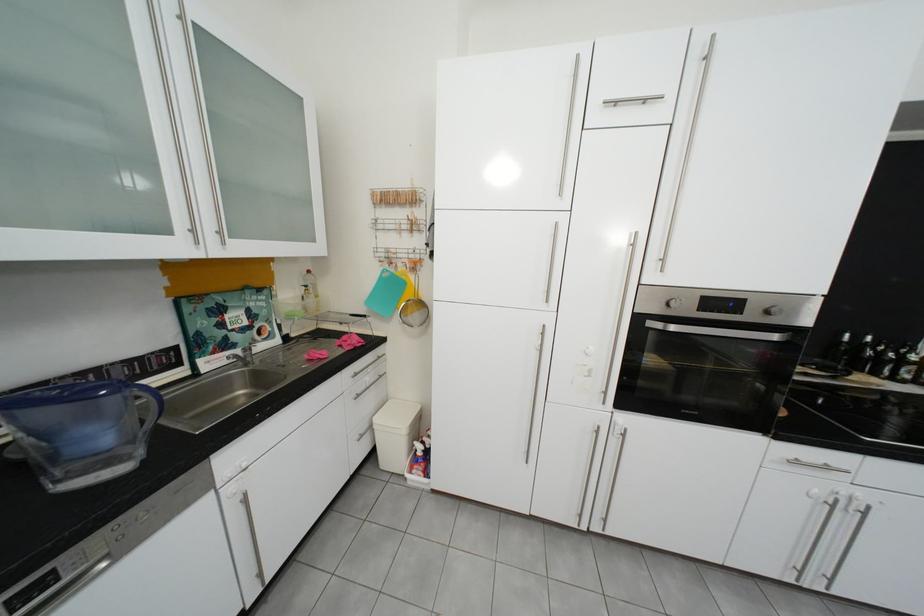
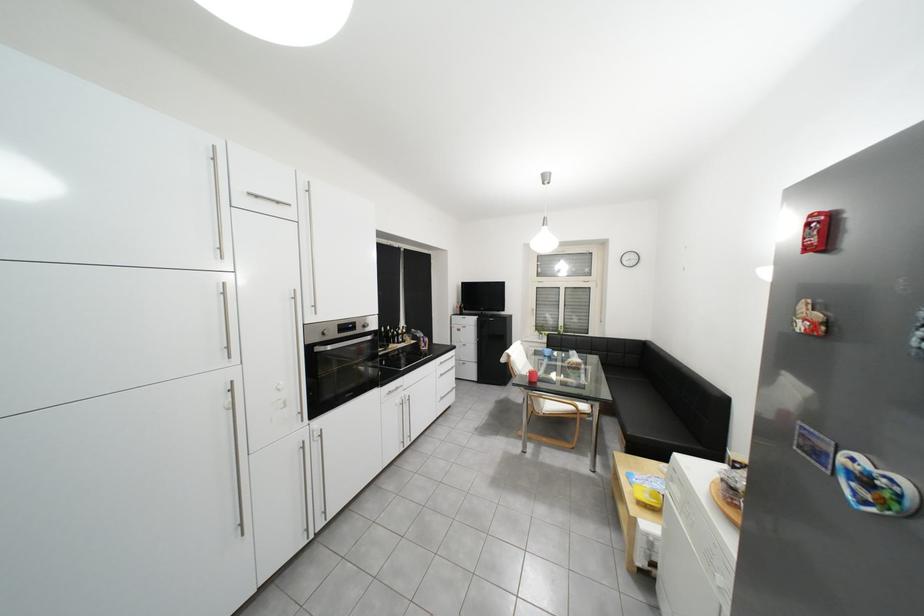
Locate, in the second image, the point that corresponds to point (679, 306) in the first image.

(334, 334)